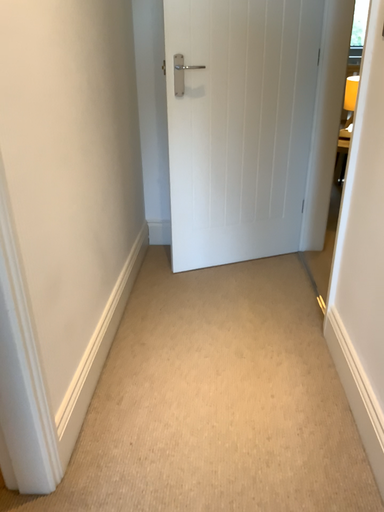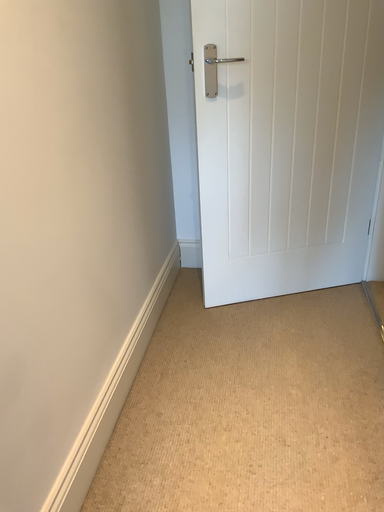
Question: How did the camera likely rotate when shooting the video?

Choices:
 (A) rotated left
 (B) rotated right

Answer: (A)